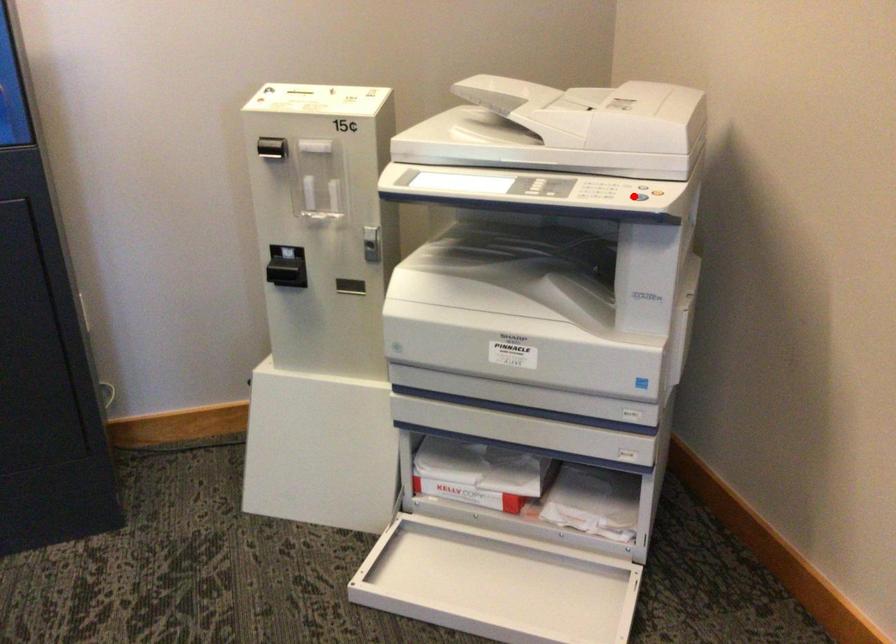
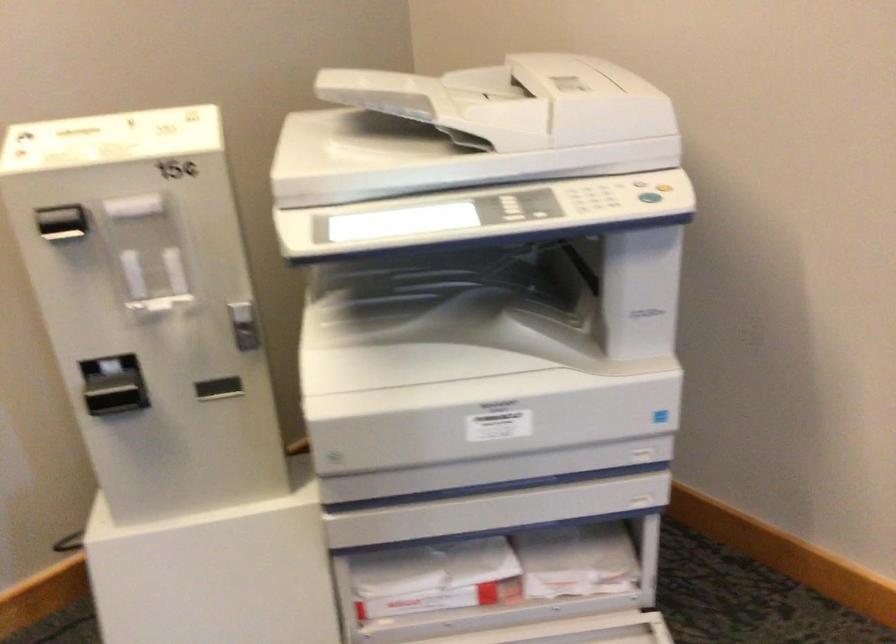
Question: A red point is marked in image1. In image2, is the corresponding 3D point closer to the camera or farther? Reply with the corresponding letter.

Choices:
 (A) The corresponding 3D point is closer.
 (B) The corresponding 3D point is farther.

Answer: (A)